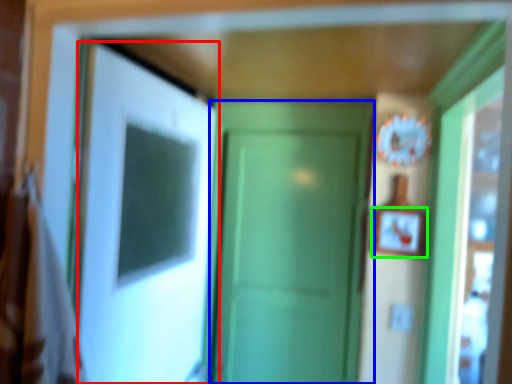
Question: Considering the real-world distances, which object is farthest from door (highlighted by a red box)? door (highlighted by a blue box) or picture frame (highlighted by a green box)?

Choices:
 (A) door
 (B) picture frame

Answer: (B)